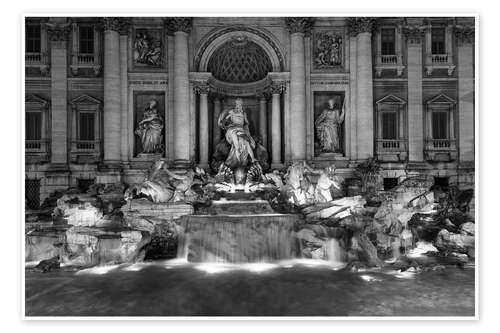
You are a GUI agent. You are given a task and a screenshot of the screen. Output one action in this format:
    pyautogui.click(x=<x>, y=<y>)
    Task: Click on the column
    This screenshot has height=333, width=500.
    Given the screenshot: What is the action you would take?
    416,60, 469,85, 364,100, 302,106, 277,109, 207,120, 190,114, 114,122, 47,135